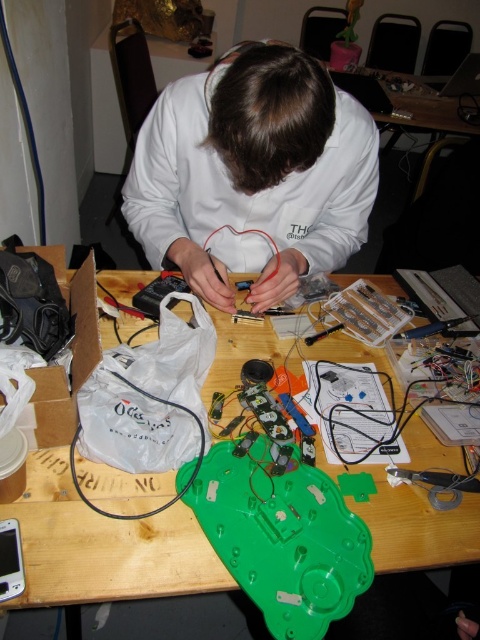
You are a repair technician who needs to reach the green plastic table at center while standing in front of the white matte shirt at center. Can you comfortably reach the table without moving your feet?

The white matte shirt at center and green plastic table at center are 11.40 inches apart, so yes, you can comfortably reach the green plastic table at center without moving your feet as the distance is within typical arm reach.

You are observing a person working on an electronic project. You notice the white matte shirt at center and the green plastic table at center. Which object is closer to you?

The white matte shirt at center is closer to you because it is positioned further to the viewer than the green plastic table at center.

You are an assistant helping someone with an electronics project. You notice the white matte shirt at center and the green plastic table at center. Which object is closer to the viewer?

The white matte shirt at center is closer to the viewer because it is located above the green plastic table at center.